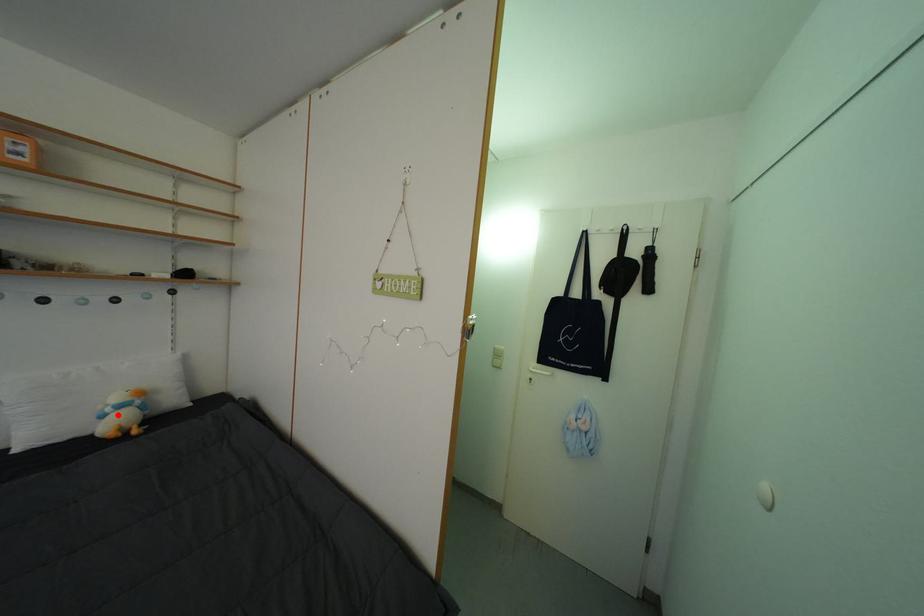
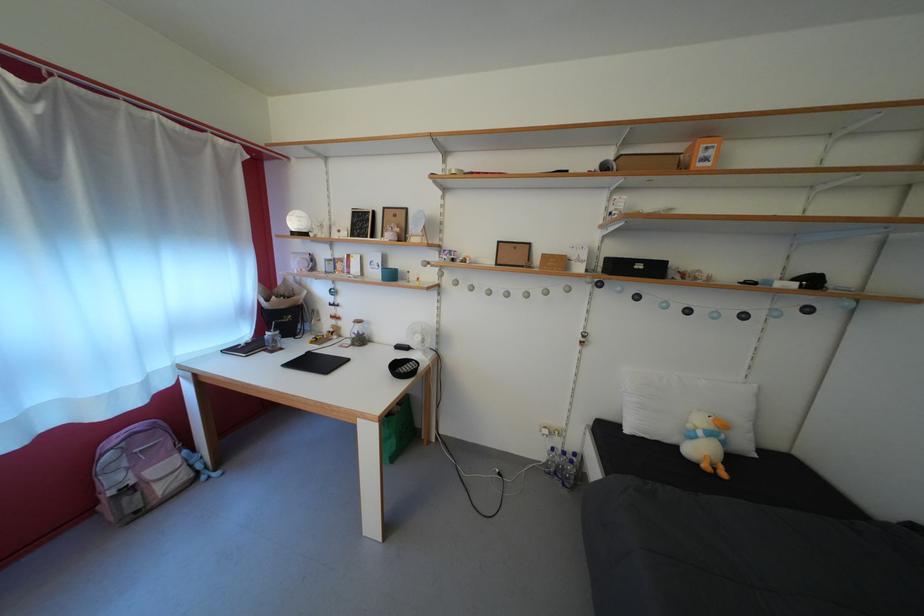
The point at the highlighted location is marked in the first image. Where is the corresponding point in the second image?

(709, 439)